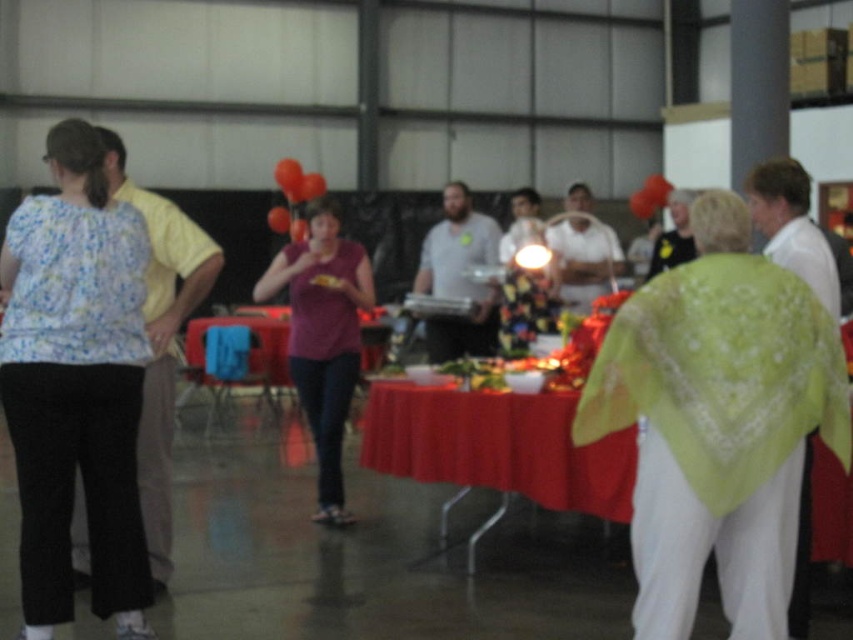
Question: Which object is closer to the camera taking this photo?

Choices:
 (A) red rubber balloon at center
 (B) red matte balloon at center
 (C) linen green shawl at right
 (D) red fabric table at center

Answer: (C)

Question: Is floral fabric blouse at left smaller than purple matte shirt at center?

Choices:
 (A) yes
 (B) no

Answer: (A)

Question: Can you confirm if rubber orange balloon at upper center is positioned to the right of orange matte balloon at center?

Choices:
 (A) no
 (B) yes

Answer: (A)

Question: Does linen green shawl at right appear on the left side of purple matte shirt at center?

Choices:
 (A) no
 (B) yes

Answer: (A)

Question: Which point is farther to the camera?

Choices:
 (A) (757, 525)
 (B) (344, 260)
 (C) (283, 227)

Answer: (C)

Question: Estimate the real-world distances between objects in this image. Which object is closer to the floral fabric blouse at left?

Choices:
 (A) orange matte balloon at center
 (B) purple matte shirt at center
 (C) red matte balloon at center

Answer: (B)